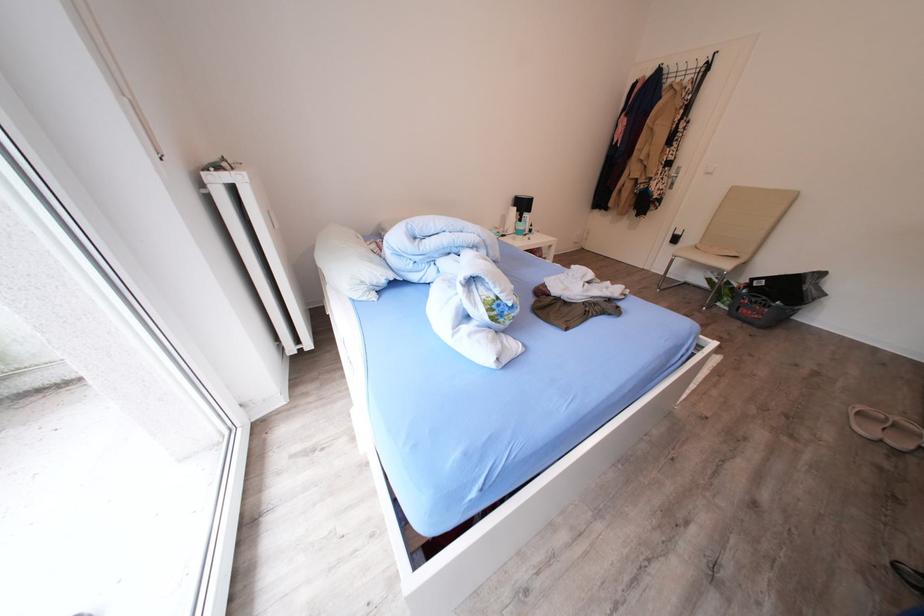
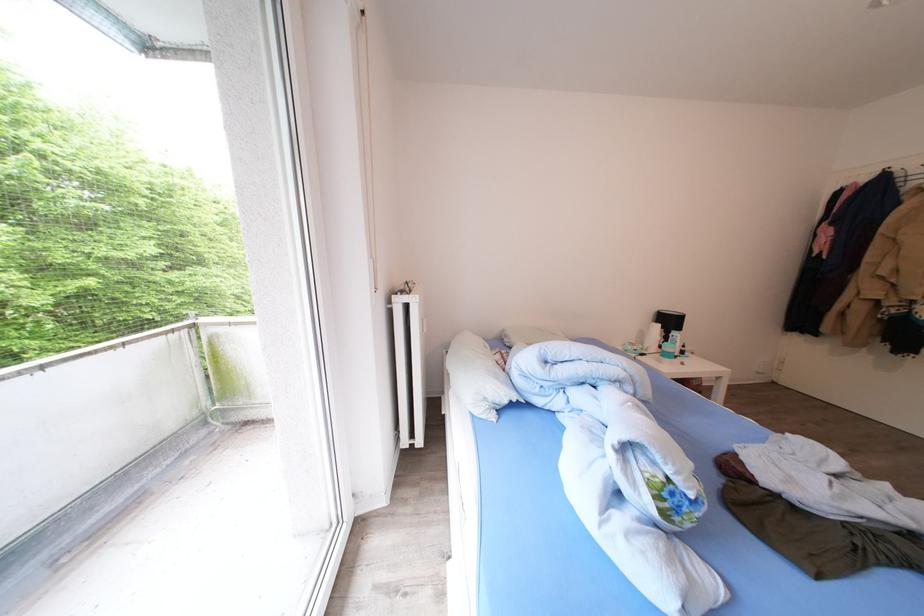
The point at (380, 267) is marked in the first image. Where is the corresponding point in the second image?

(505, 383)